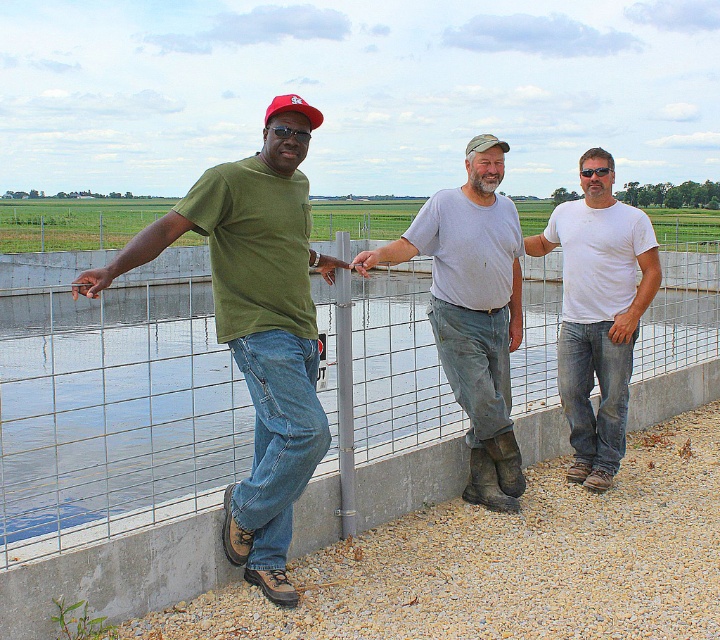
Is clear water at center positioned in front of white matte t-shirt at center?

Yes, clear water at center is closer to the viewer.

Between clear water at center and white matte t-shirt at center, which one has more height?

clear water at center

Which is in front, point (144, 436) or point (594, 372)?

Point (594, 372)

Where is `clear water at center`? The image size is (720, 640). clear water at center is located at coordinates (112, 413).

Does green matte t-shirt at center appear on the right side of red matte baseball cap at upper left?

Indeed, green matte t-shirt at center is positioned on the right side of red matte baseball cap at upper left.

The height and width of the screenshot is (640, 720). I want to click on green matte t-shirt at center, so click(256, 330).

Find the location of a particular element. green matte t-shirt at center is located at coordinates (256, 330).

Between point (436, 298) and point (600, 186), which one is positioned in front?

Point (436, 298) is more forward.

Is the position of gray matte shirt at center less distant than that of white matte t-shirt at center?

Yes, it is in front of white matte t-shirt at center.

Does point (426, 209) lie behind point (576, 237)?

No, (426, 209) is closer to viewer.

Find the location of a particular element. gray matte shirt at center is located at coordinates (472, 310).